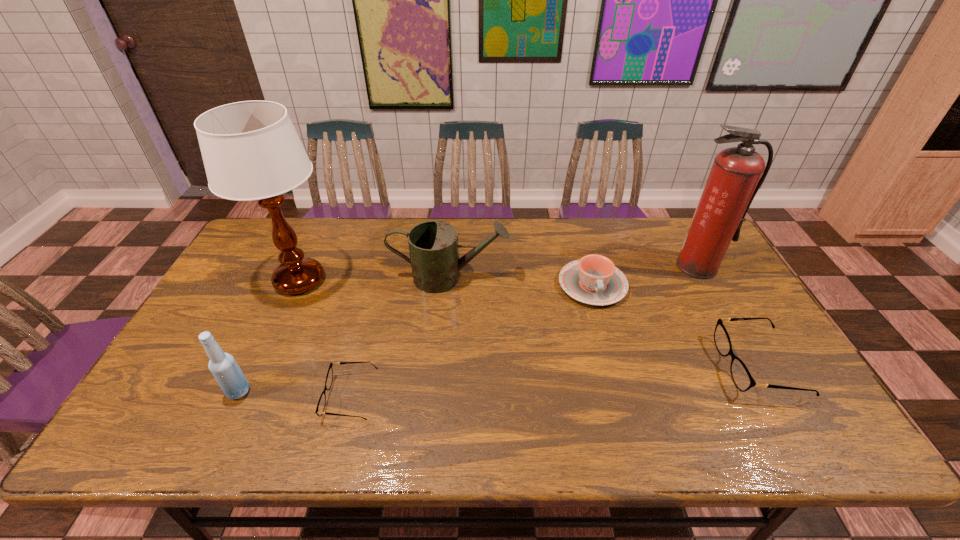
Find the location of a particular element. This screenshot has width=960, height=540. the shorter spectacles is located at coordinates (320, 408).

The height and width of the screenshot is (540, 960). What are the coordinates of `the left spectacles` in the screenshot? It's located at (320, 408).

Locate an element on the screen. The image size is (960, 540). the sixth tallest object is located at coordinates (740, 374).

Identify the location of the taller spectacles. This screenshot has width=960, height=540. (740, 374).

Identify the location of table lamp. Image resolution: width=960 pixels, height=540 pixels. (251, 151).

Find the location of a particular element. watering can is located at coordinates (433, 245).

Where is `fire extinguisher`? fire extinguisher is located at coordinates (736, 175).

Identify the location of the fifth object from left to right. This screenshot has height=540, width=960. (594, 280).

Find the location of `chinaware`. chinaware is located at coordinates (594, 280).

At what (x,y) coordinates should I click in order to perform the action: click on bottle. Please return your answer as a coordinate pair (x, y). This screenshot has height=540, width=960. Looking at the image, I should click on (227, 373).